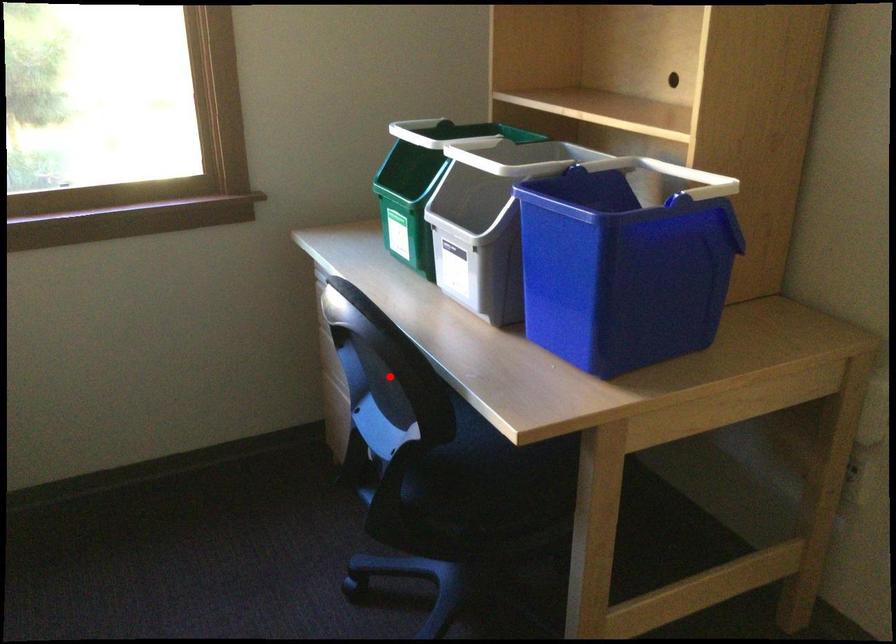
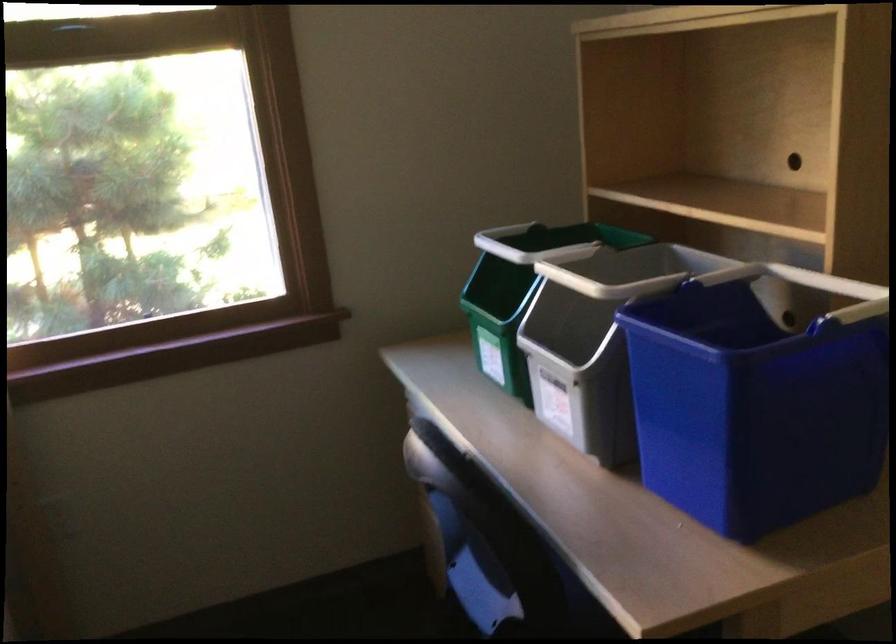
Question: I am providing you with two images of the same scene from different viewpoints. A red point is marked on the first image. Is the red point's position out of view in image 2?

Choices:
 (A) Yes
 (B) No

Answer: (B)